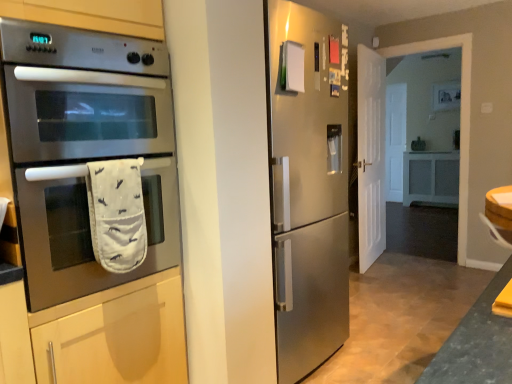
Question: Can you confirm if white fabric oven mitt at lower left is positioned to the left of white matte door at right?

Choices:
 (A) yes
 (B) no

Answer: (A)

Question: From a real-world perspective, is white fabric oven mitt at lower left beneath white matte door at right?

Choices:
 (A) no
 (B) yes

Answer: (A)

Question: Is white matte door at right at the back of white fabric oven mitt at lower left?

Choices:
 (A) no
 (B) yes

Answer: (A)

Question: From the image's perspective, is white fabric oven mitt at lower left beneath white matte door at right?

Choices:
 (A) yes
 (B) no

Answer: (A)

Question: Is the depth of white fabric oven mitt at lower left less than that of white matte door at right?

Choices:
 (A) yes
 (B) no

Answer: (A)

Question: Is white matte door at right in front of or behind white fabric oven mitt at lower left in the image?

Choices:
 (A) front
 (B) behind

Answer: (B)

Question: From their relative heights in the image, would you say white matte door at right is taller or shorter than white fabric oven mitt at lower left?

Choices:
 (A) tall
 (B) short

Answer: (A)

Question: Is white matte door at right to the left or to the right of white fabric oven mitt at lower left in the image?

Choices:
 (A) right
 (B) left

Answer: (A)

Question: Would you say white matte door at right is inside or outside white fabric oven mitt at lower left?

Choices:
 (A) outside
 (B) inside

Answer: (A)

Question: Looking at their shapes, would you say stainless steel oven at left is wider or thinner than white fabric oven mitt at lower left?

Choices:
 (A) thin
 (B) wide

Answer: (B)

Question: Considering the positions of stainless steel oven at left and white fabric oven mitt at lower left in the image, is stainless steel oven at left bigger or smaller than white fabric oven mitt at lower left?

Choices:
 (A) big
 (B) small

Answer: (A)

Question: Does point (48, 104) appear closer or farther from the camera than point (138, 261)?

Choices:
 (A) closer
 (B) farther

Answer: (A)

Question: From a real-world perspective, is stainless steel oven at left positioned above or below white fabric oven mitt at lower left?

Choices:
 (A) below
 (B) above

Answer: (B)

Question: Is stainless steel oven at left inside the boundaries of white matte door at right, or outside?

Choices:
 (A) inside
 (B) outside

Answer: (B)

Question: In terms of size, does stainless steel oven at left appear bigger or smaller than white matte door at right?

Choices:
 (A) small
 (B) big

Answer: (B)